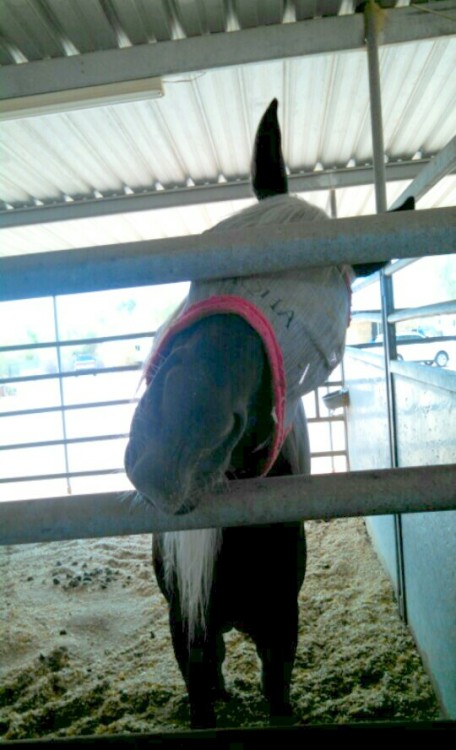
Identify the location of hood. (321, 292).